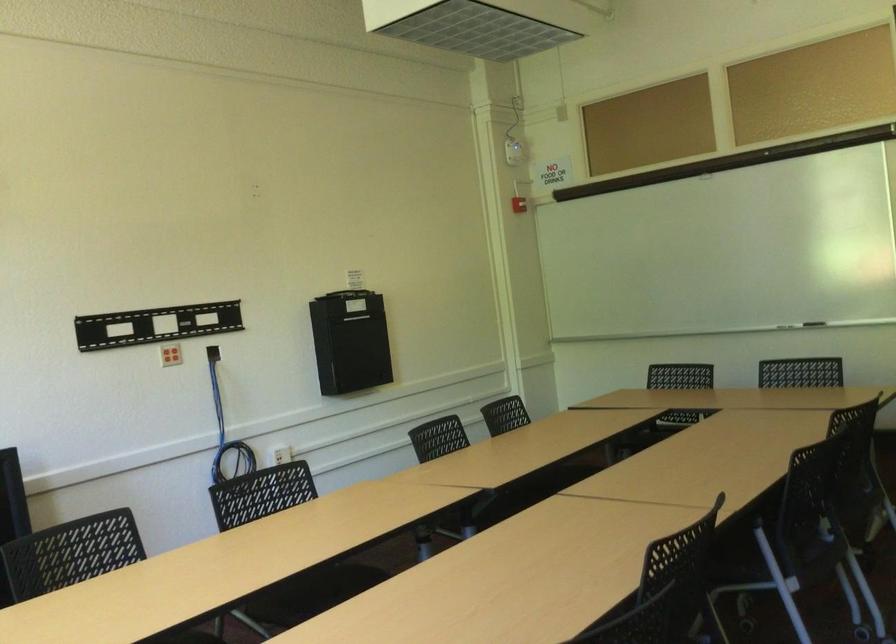
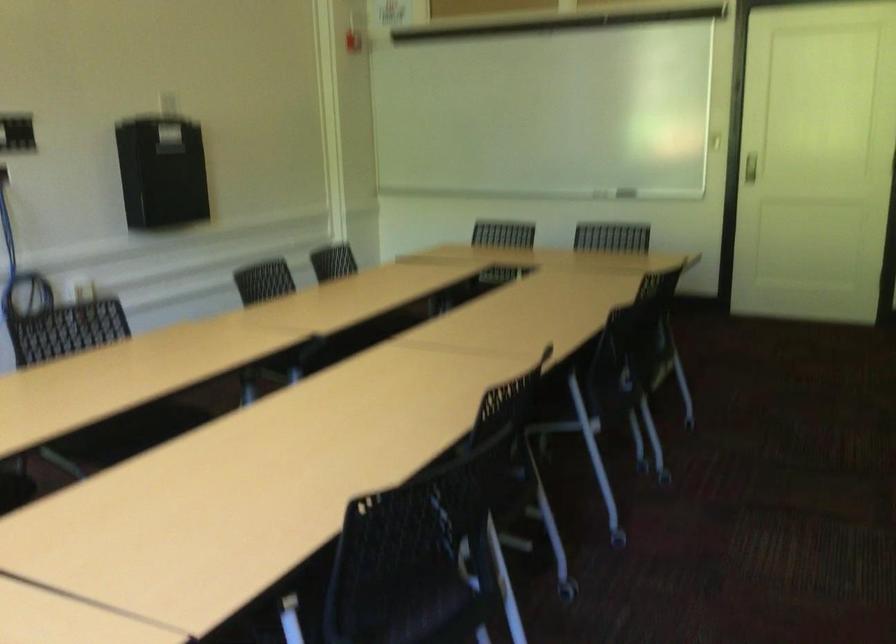
What movement of the cameraman would produce the second image?

The movement direction of the cameraman is left, forward.